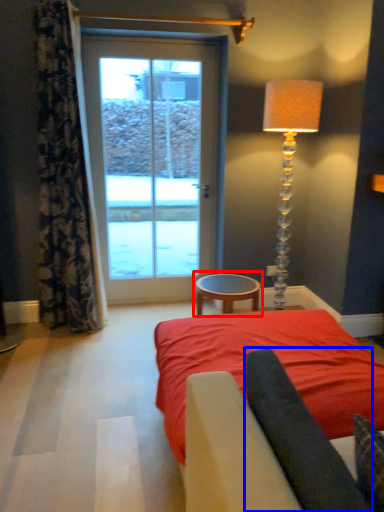
Question: Which point is closer to the camera, table (highlighted by a red box) or dark (highlighted by a blue box)?

Choices:
 (A) table
 (B) dark

Answer: (B)